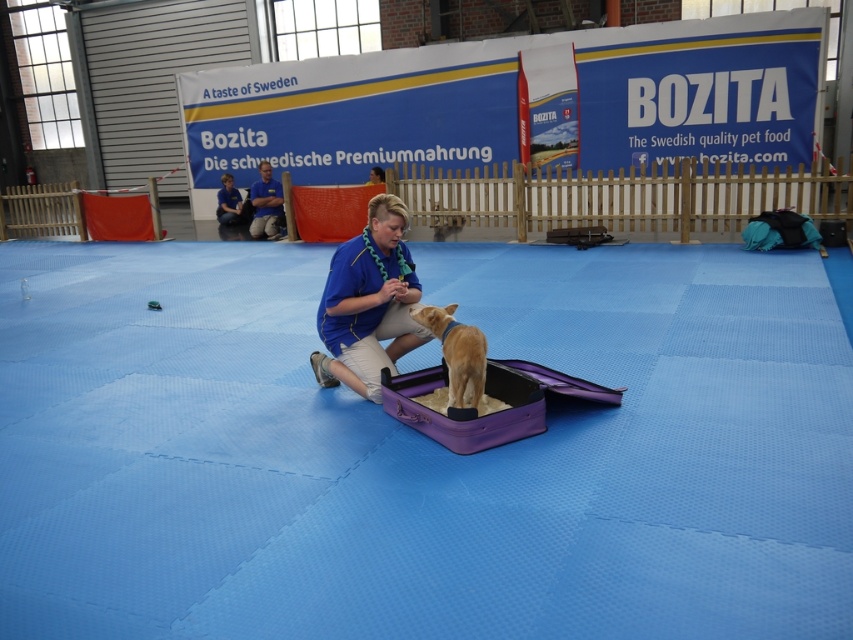
You are a photographer setting up for a pet product photo shoot. You need to ensure the golden fur dog at center and the blue shirt at center are both visible in the frame. Based on their positions, which object is closer to the camera?

The golden fur dog at center is positioned under the blue shirt at center, so the blue shirt at center is closer to the camera.

From the picture: You are a photographer at the event. You need to capture a clear photo of the golden fur dog at center without the blue shirt at center blocking it. Based on their positions, is this possible?

The golden fur dog at center is in front of the blue shirt at center, so the blue shirt at center will block the view of the golden fur dog at center. Therefore, it is not possible to take a clear photo of the golden fur dog at center without the blue shirt at center blocking it.

You are a photographer setting up for a pet product photoshoot. You need to ensure that the golden fur dog at center and the blue shirt at center are both visible in the frame. Based on their heights, which one might require adjusting the camera angle to be fully captured?

The golden fur dog at center is shorter than the blue shirt at center, so the camera angle might need to be lowered to ensure the dog is fully visible while the blue shirt remains in frame.